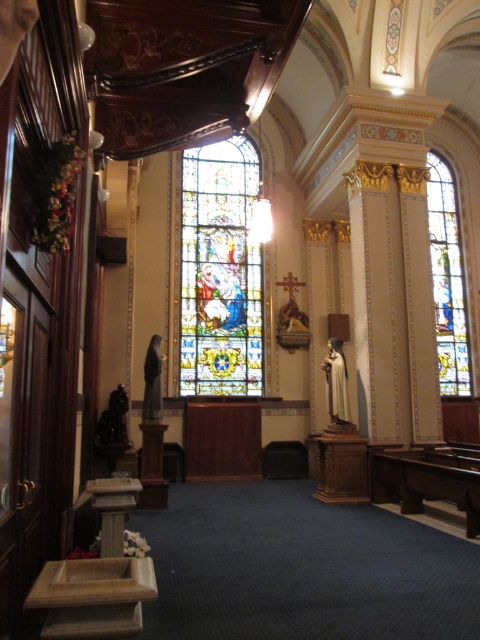
Question: Which point is farther to the camera?

Choices:
 (A) (180, 227)
 (B) (456, 371)

Answer: (B)

Question: Among these objects, which one is farthest from the camera?

Choices:
 (A) stained glass window at center
 (B) stained glass window at right

Answer: (A)

Question: Does stained glass window at center have a greater width compared to stained glass window at right?

Choices:
 (A) no
 (B) yes

Answer: (A)

Question: Which point is closer to the camera taking this photo?

Choices:
 (A) (235, 218)
 (B) (444, 337)

Answer: (A)

Question: Is stained glass window at center behind stained glass window at right?

Choices:
 (A) yes
 (B) no

Answer: (A)

Question: Is stained glass window at center positioned before stained glass window at right?

Choices:
 (A) no
 (B) yes

Answer: (A)